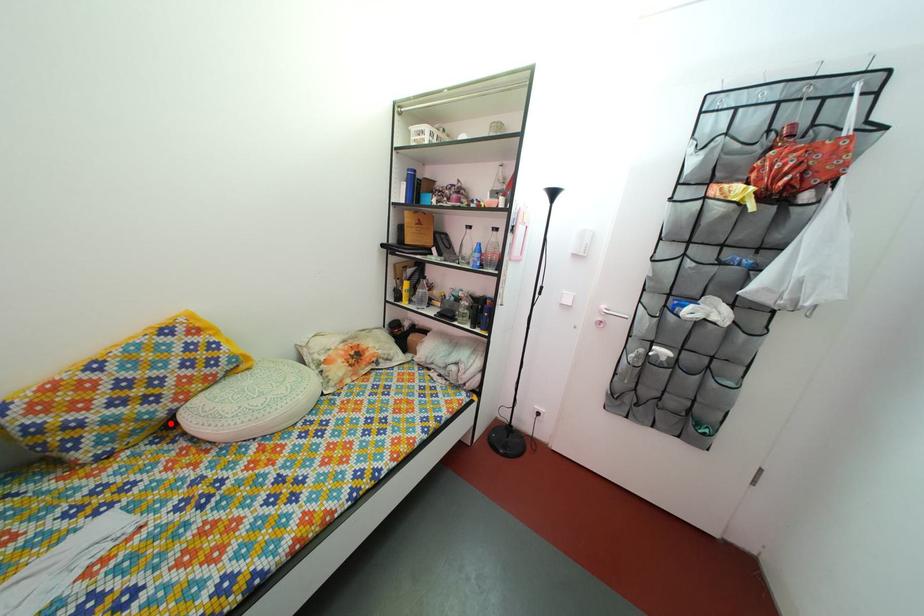
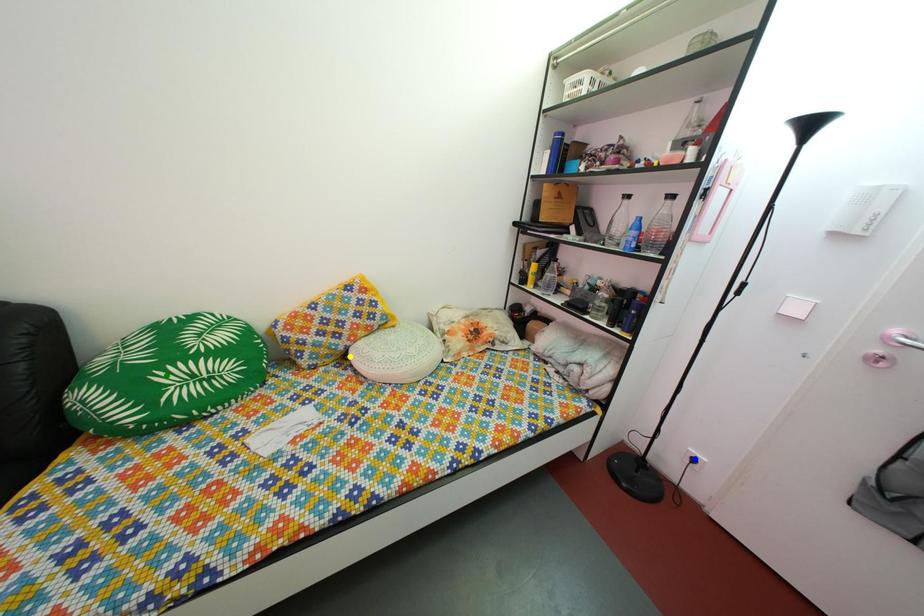
Question: I am providing you with two images of the same scene from different viewpoints. A red point is marked on the first image. You are given multiple points on the second image. In image 2, which mark is for the same physical point as the one in image 1?

Choices:
 (A) green point
 (B) blue point
 (C) yellow point

Answer: (C)